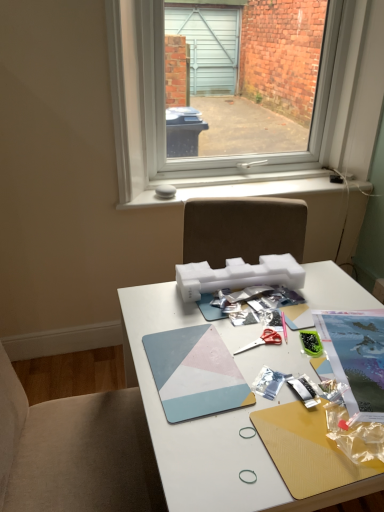
I want to click on blank space situated above white matte desk at center (from a real-world perspective), so click(x=273, y=350).